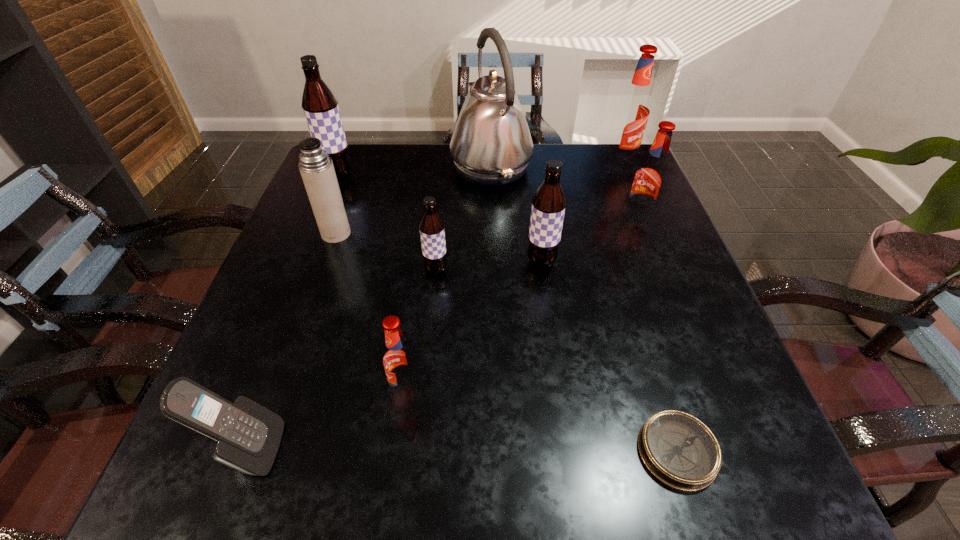
Locate an element on the screen. kettle is located at coordinates (491, 145).

You are a GUI agent. You are given a task and a screenshot of the screen. Output one action in this format:
    pyautogui.click(x=<x>, y=<y>)
    Task: Click on the farthest brown root beer
    This screenshot has height=540, width=960.
    Given the screenshot: What is the action you would take?
    pyautogui.click(x=320, y=105)

Identify the location of the leftmost root beer. (320, 105).

The height and width of the screenshot is (540, 960). In order to click on the biggest red root beer in this screenshot , I will do `click(633, 109)`.

I want to click on the third farthest root beer, so click(x=650, y=178).

The image size is (960, 540). Identify the location of the second biggest red root beer. 650,178.

Locate an element on the screen. The image size is (960, 540). the rightmost brown root beer is located at coordinates (549, 202).

In order to click on the fourth root beer from left to right in this screenshot , I will do pos(549,202).

The width and height of the screenshot is (960, 540). What are the coordinates of `thermos bottle` in the screenshot? It's located at (316, 168).

Where is `the smallest red root beer`? The height and width of the screenshot is (540, 960). the smallest red root beer is located at coordinates (399, 360).